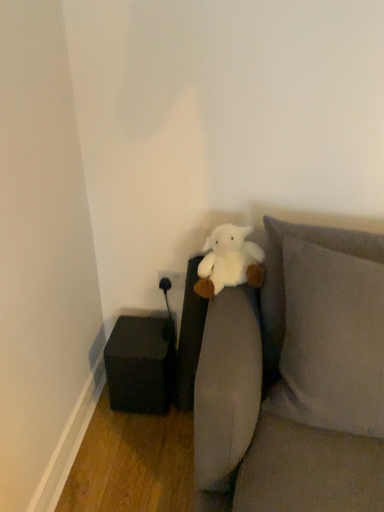
Question: From a real-world perspective, relative to soft gray fabric couch at center, is black matte cube at lower left vertically above or below?

Choices:
 (A) below
 (B) above

Answer: (A)

Question: Considering the positions of point (127, 382) and point (221, 300), is point (127, 382) closer or farther from the camera than point (221, 300)?

Choices:
 (A) farther
 (B) closer

Answer: (A)

Question: Which object is positioned closest to the black matte cube at lower left?

Choices:
 (A) soft gray fabric couch at center
 (B) white plush at center

Answer: (B)

Question: Based on their relative distances, which object is nearer to the soft gray fabric couch at center?

Choices:
 (A) white plush at center
 (B) black matte cube at lower left

Answer: (A)